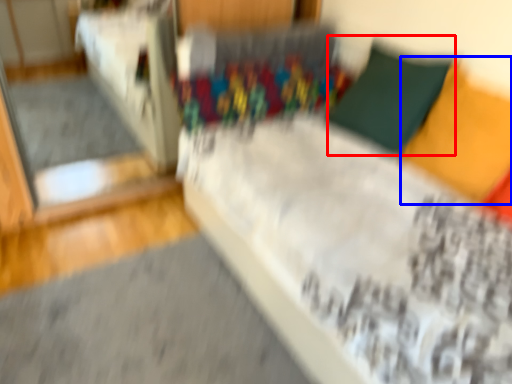
Question: Which of the following is the farthest to the observer, pillow (highlighted by a red box) or pillow (highlighted by a blue box)?

Choices:
 (A) pillow
 (B) pillow

Answer: (A)